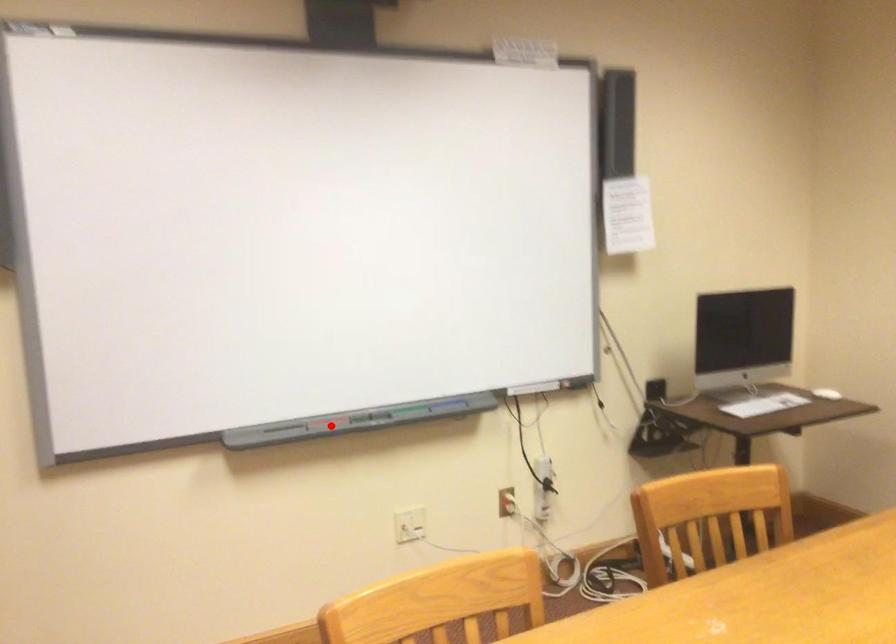
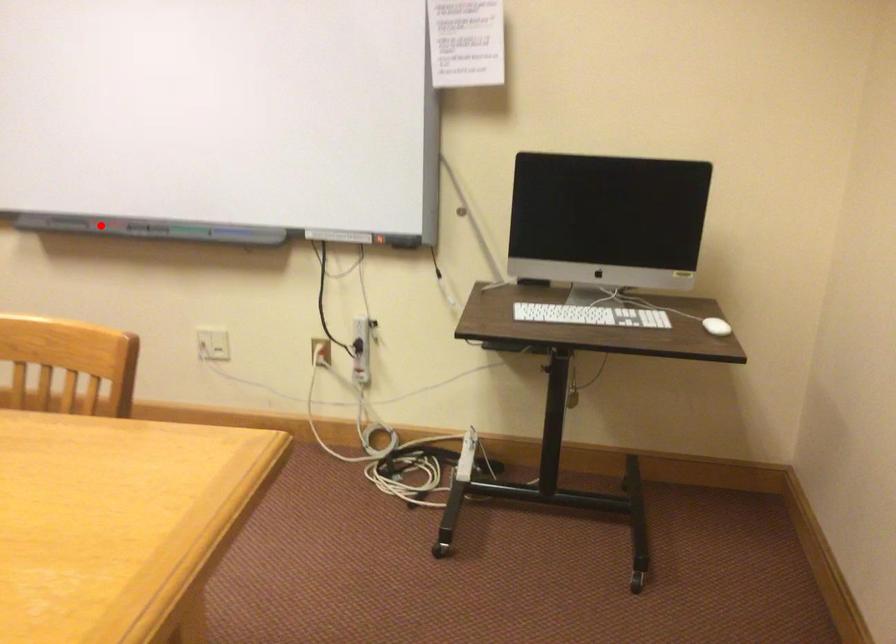
Consider the image. I am providing you with two images of the same scene from different viewpoints. A red point is marked on the first image and another point is marked on the second image. Is the red point in image1 aligned with the point shown in image2?

Yes